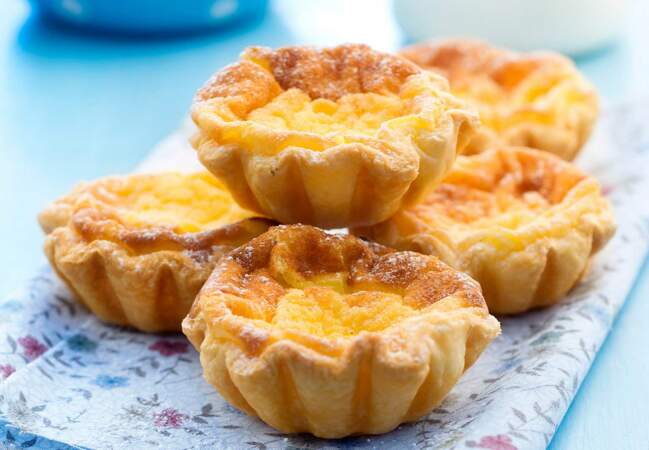
Where is `table`? Image resolution: width=649 pixels, height=450 pixels. table is located at coordinates (87, 110).